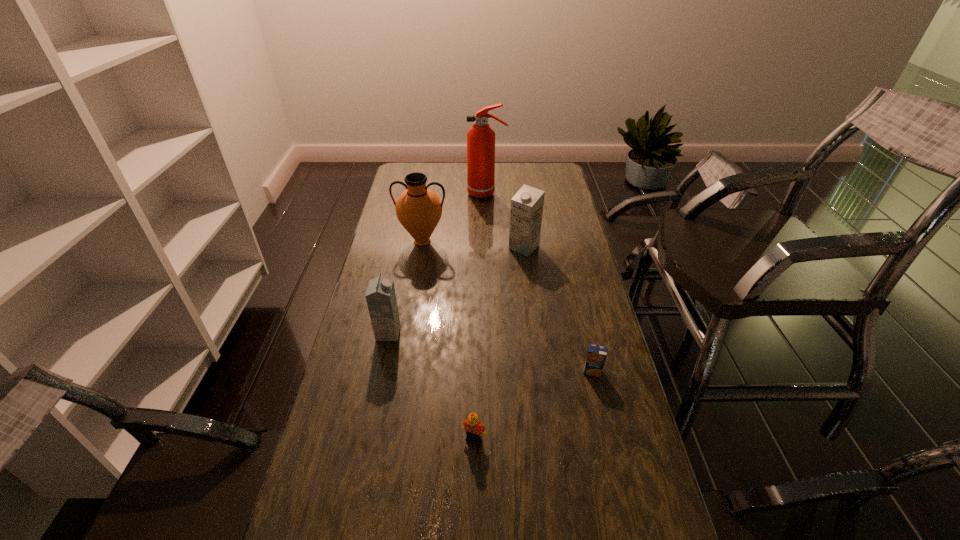
The width and height of the screenshot is (960, 540). What are the coordinates of `fire extinguisher` in the screenshot? It's located at (480, 138).

Identify the location of the tallest object. (480, 138).

Locate an element on the screen. pitcher is located at coordinates (418, 208).

You are a GUI agent. You are given a task and a screenshot of the screen. Output one action in this format:
    pyautogui.click(x=<x>, y=<y>)
    Task: Click on the right carton
    Image resolution: width=960 pixels, height=540 pixels.
    Given the screenshot: What is the action you would take?
    pyautogui.click(x=526, y=212)

This screenshot has height=540, width=960. What are the coordinates of `the third nearest object` in the screenshot? It's located at (381, 300).

The image size is (960, 540). I want to click on the left carton, so click(x=381, y=300).

The width and height of the screenshot is (960, 540). In order to click on the nearest object in this screenshot , I will do `click(474, 429)`.

Locate an element on the screen. the fifth farthest object is located at coordinates (596, 356).

At what (x,y) coordinates should I click in order to perform the action: click on orange_juice. Please return your answer as a coordinate pair (x, y). Looking at the image, I should click on (596, 356).

At what (x,y) coordinates should I click in order to perform the action: click on free space located at the nozzle of the tallest object. Please return your answer as a coordinate pair (x, y). This screenshot has width=960, height=540. Looking at the image, I should click on (418, 193).